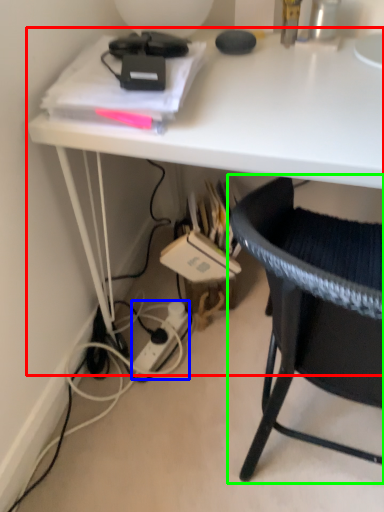
Question: Which object is the farthest from desk (highlighted by a red box)? Choose among these: power outlet (highlighted by a blue box) or chair (highlighted by a green box).

Choices:
 (A) power outlet
 (B) chair

Answer: (A)